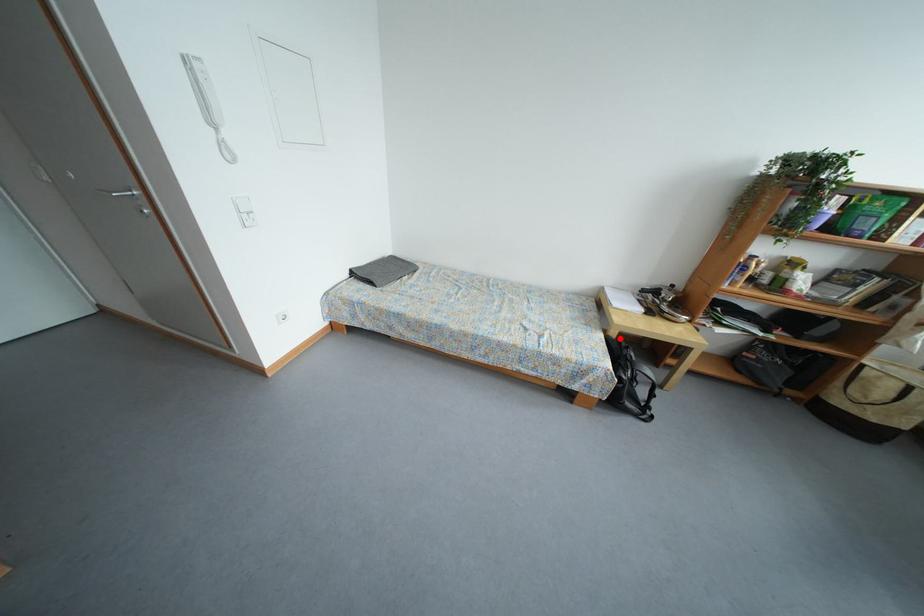
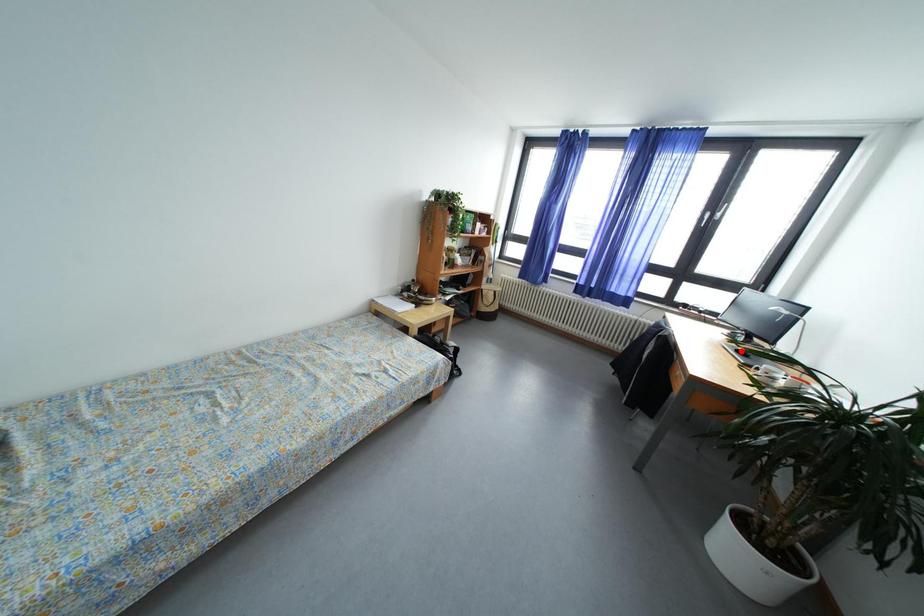
I am providing you with two images of the same scene from different viewpoints. A red point is marked on the first image and another point is marked on the second image. Is the red point in image1 aligned with the point shown in image2?

No